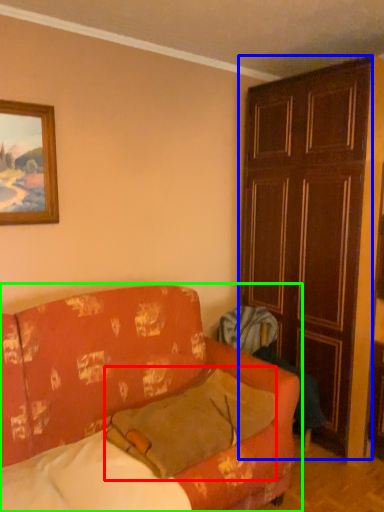
Question: Considering the real-world distances, which object is closest to pillow (highlighted by a red box)? door (highlighted by a blue box) or studio couch (highlighted by a green box).

Choices:
 (A) door
 (B) studio couch

Answer: (B)